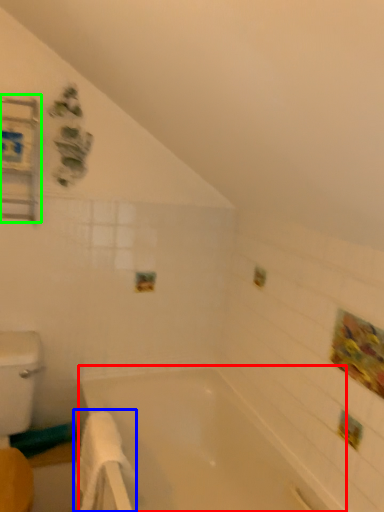
Question: Which object is the closest to the bathtub (highlighted by a red box)? Choose among these: bath towel (highlighted by a blue box) or medicine cabinet (highlighted by a green box).

Choices:
 (A) bath towel
 (B) medicine cabinet

Answer: (A)